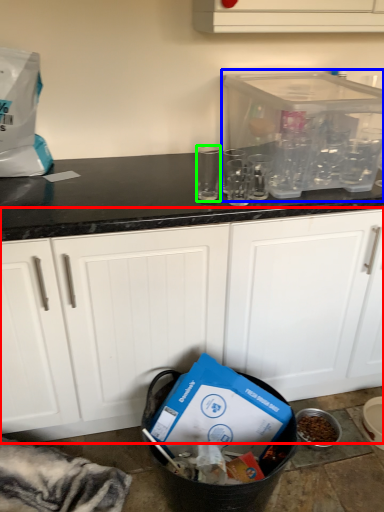
Question: Based on their relative distances, which object is nearer to cabinetry (highlighted by a red box)? Choose from appliance (highlighted by a blue box) and clear (highlighted by a green box).

Choices:
 (A) appliance
 (B) clear

Answer: (A)